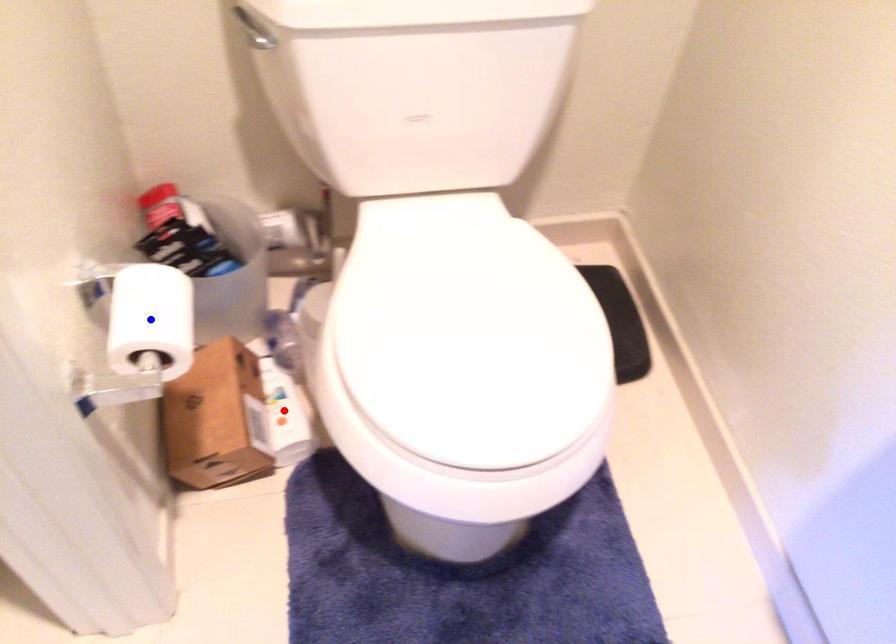
Question: Two points are marked on the image. Which point is closer to the camera?

Choices:
 (A) Blue point is closer.
 (B) Red point is closer.

Answer: (A)